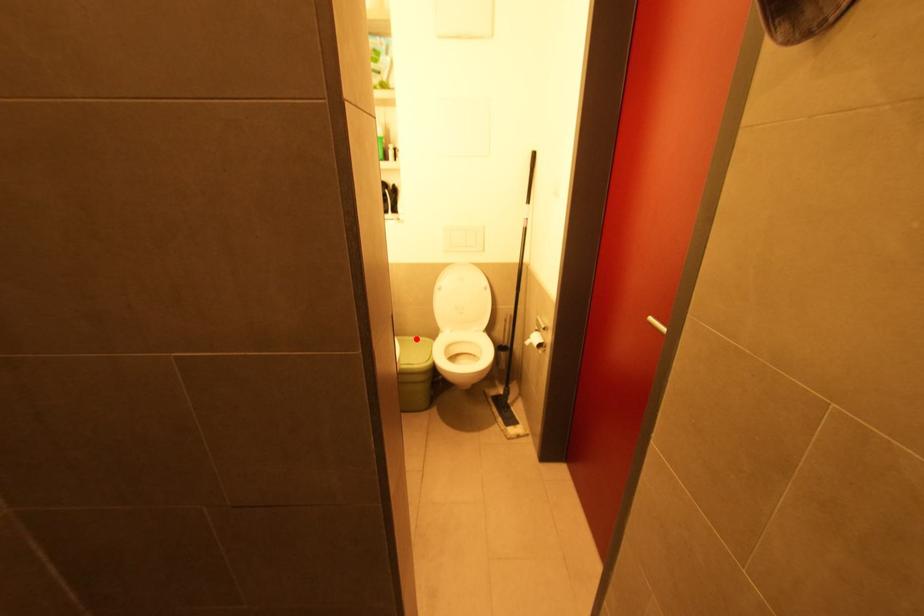
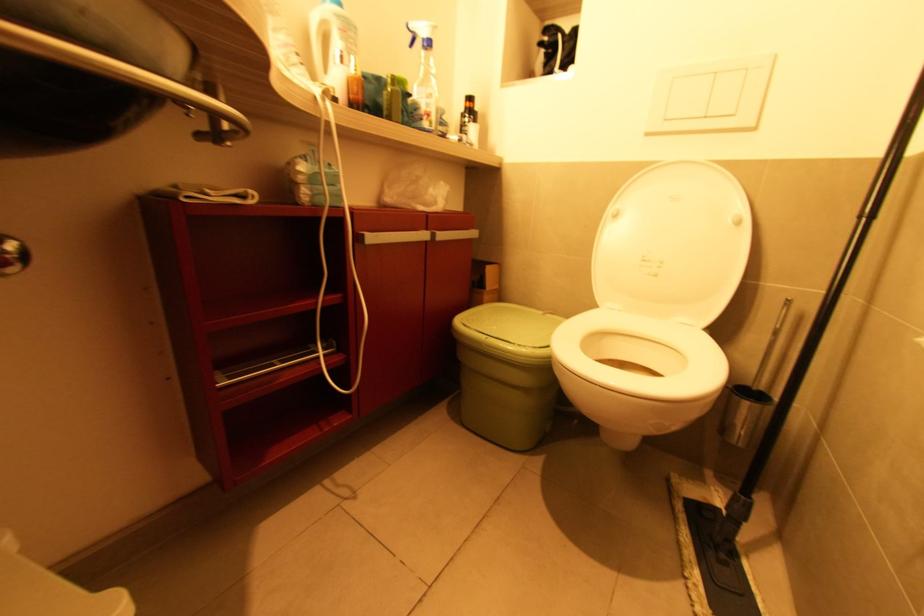
In the second image, find the point that corresponds to the highlighted location in the first image.

(545, 314)